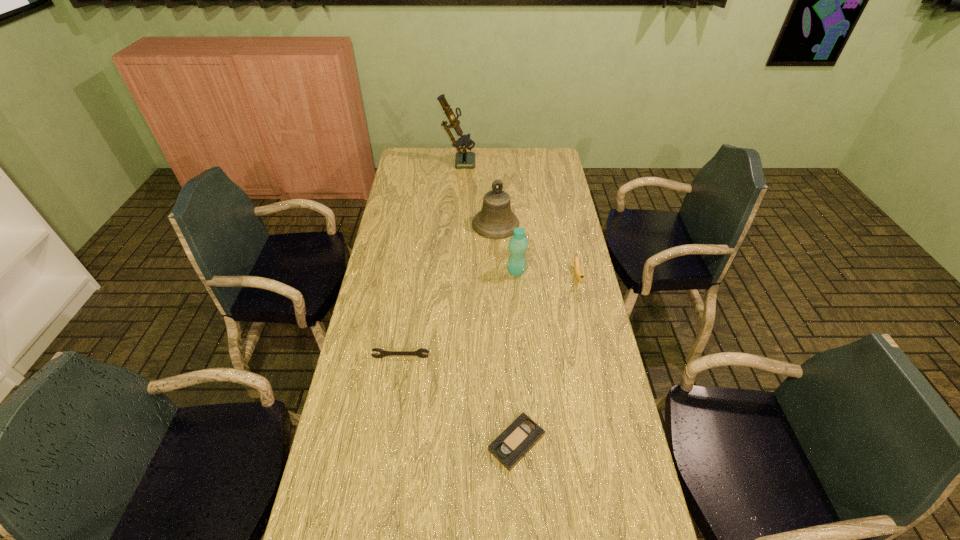
You are a GUI agent. You are given a task and a screenshot of the screen. Output one action in this format:
    pyautogui.click(x=<x>, y=<y>)
    Task: Click on the vacant space located at the eyepiece of the farthest object
    
    Given the screenshot: What is the action you would take?
    pyautogui.click(x=554, y=160)

At what (x,y) coordinates should I click in order to perform the action: click on vacant space located on the front of the fifth nearest object. Please return your answer as a coordinate pair (x, y). This screenshot has height=540, width=960. Looking at the image, I should click on (498, 289).

Locate an element on the screen. Image resolution: width=960 pixels, height=540 pixels. free space located 0.400m on the left of the bottle is located at coordinates (401, 272).

Where is `free space located 0.100m at the stem of the third shortest object`? This screenshot has height=540, width=960. free space located 0.100m at the stem of the third shortest object is located at coordinates (585, 310).

Identify the location of free region located on the open ends of the second shortest object. The image size is (960, 540). (386, 459).

Identify the location of free space located 0.160m on the left of the videotape. (429, 443).

This screenshot has height=540, width=960. I want to click on object that is at the far edge, so click(x=464, y=159).

Image resolution: width=960 pixels, height=540 pixels. I want to click on object located at the left edge, so click(383, 353).

Where is `object positioned at the right edge`? object positioned at the right edge is located at coordinates (x=579, y=277).

In the image, there is a desktop. Where is `vacant space at the far edge`? This screenshot has width=960, height=540. vacant space at the far edge is located at coordinates (516, 154).